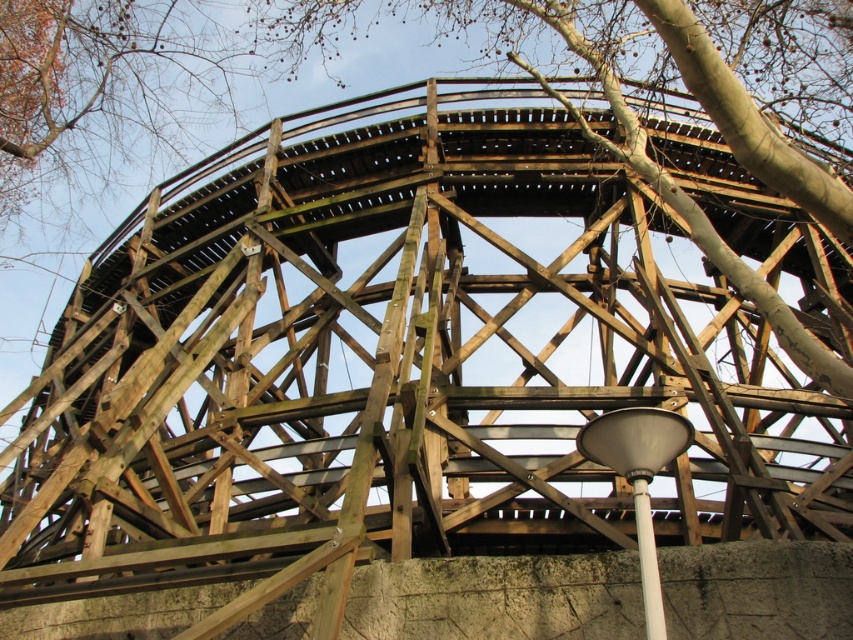
Who is lower down, brown wood tree at center or white plastic pole at lower center?

white plastic pole at lower center is lower down.

Who is higher up, brown wood tree at center or white plastic pole at lower center?

brown wood tree at center is higher up.

Is point (688, 204) closer to camera compared to point (642, 499)?

No, (688, 204) is further to viewer.

I want to click on brown wood tree at center, so click(x=671, y=96).